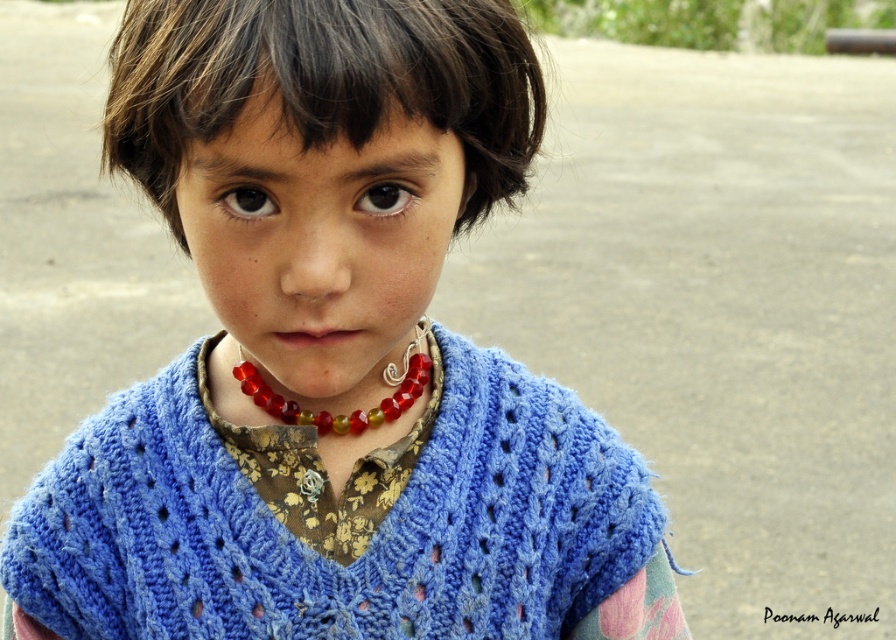
Question: Where is blue knitted shawl at center located in relation to translucent red beads at center in the image?

Choices:
 (A) above
 (B) below

Answer: (B)

Question: Which of the following is the farthest from the observer?

Choices:
 (A) (375, 406)
 (B) (358, 604)

Answer: (A)

Question: Is blue knitted shawl at center to the left of translucent red beads at center from the viewer's perspective?

Choices:
 (A) yes
 (B) no

Answer: (A)

Question: Which point is farther from the camera taking this photo?

Choices:
 (A) (255, 488)
 (B) (392, 417)

Answer: (A)

Question: Where is blue knitted shawl at center located in relation to translucent red beads at center in the image?

Choices:
 (A) right
 (B) left

Answer: (B)